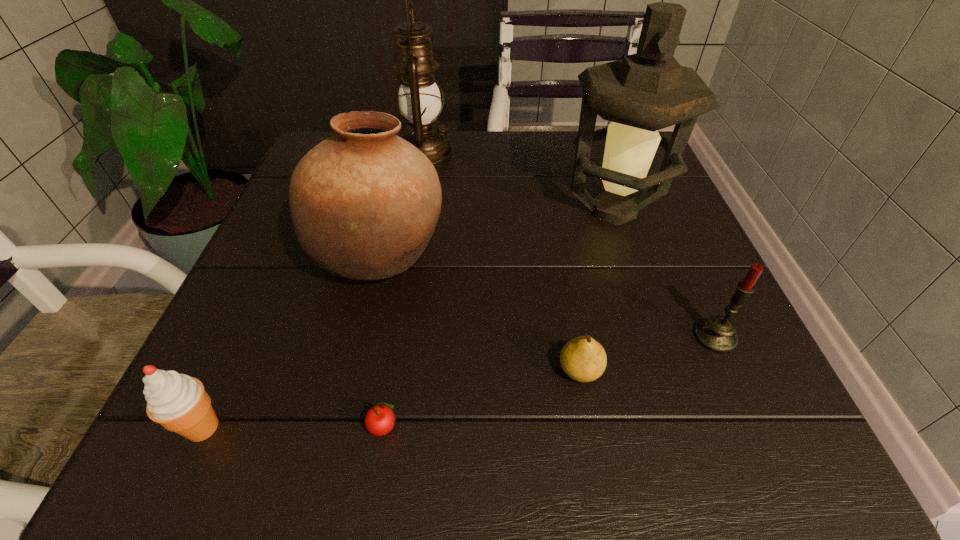
At what (x,y) coordinates should I click in order to perform the action: click on candle that is at the right edge. Please return your answer as a coordinate pair (x, y). The width and height of the screenshot is (960, 540). Looking at the image, I should click on (717, 334).

Where is `object that is at the near left corner`? The height and width of the screenshot is (540, 960). object that is at the near left corner is located at coordinates (178, 402).

The width and height of the screenshot is (960, 540). I want to click on object present at the far right corner, so click(x=644, y=92).

Image resolution: width=960 pixels, height=540 pixels. Identify the location of vacant space at the far edge of the desktop. (449, 177).

Where is `vacant region at the near edge`? vacant region at the near edge is located at coordinates (659, 434).

In the image, there is a desktop. Identify the location of free region at the left edge. (219, 389).

Where is `free space at the right edge`? The height and width of the screenshot is (540, 960). free space at the right edge is located at coordinates (679, 343).

The image size is (960, 540). Find the location of `free space between the third tallest object and the leftmost object`. free space between the third tallest object and the leftmost object is located at coordinates (292, 342).

Locate an element on the screen. The height and width of the screenshot is (540, 960). empty location between the cherry and the right oil lamp is located at coordinates (499, 319).

Identify the location of unoccupied area between the candle and the leftmost object. The image size is (960, 540). (459, 382).